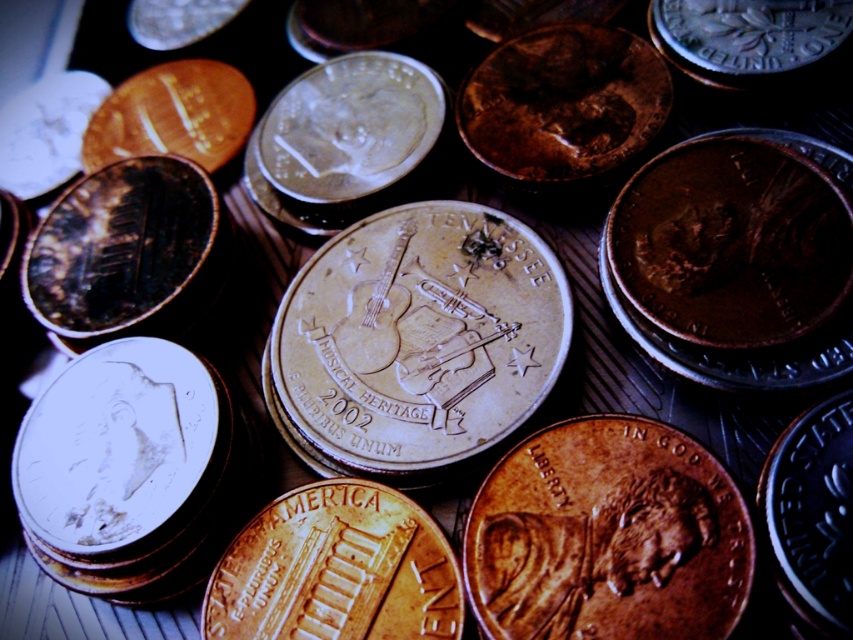
Question: Does rusty copper penny at center lie in front of silver metallic coin at upper left?

Choices:
 (A) yes
 (B) no

Answer: (A)

Question: Among these points, which one is farthest from the camera?

Choices:
 (A) (695, 602)
 (B) (32, 248)

Answer: (B)

Question: Does rusty copper penny at center appear on the right side of silver metallic maple leaf at upper right?

Choices:
 (A) no
 (B) yes

Answer: (A)

Question: Among these objects, which one is nearest to the camera?

Choices:
 (A) brass/bronze coin at upper left
 (B) silver metallic maple leaf at upper right

Answer: (A)

Question: Which point is farther from the camera taking this photo?

Choices:
 (A) (711, 67)
 (B) (791, 579)
 (C) (592, 492)

Answer: (A)

Question: Does silver metallic maple leaf at upper right appear over silver metallic coin at upper left?

Choices:
 (A) no
 (B) yes

Answer: (A)